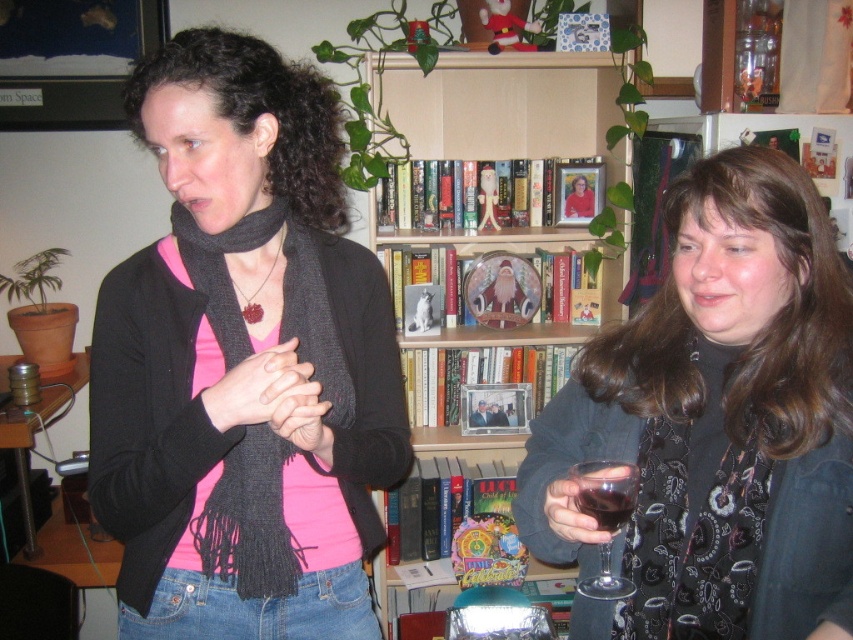
Question: From the image, what is the correct spatial relationship of dark glass at right in relation to smooth wooden frame at center?

Choices:
 (A) above
 (B) below

Answer: (A)

Question: Which object is positioned closest to the transparent glass wine glass at lower right?

Choices:
 (A) black knitted scarf at left
 (B) smooth wooden frame at center
 (C) matte black scarf at center

Answer: (A)

Question: In this image, where is matte black jacket at right located relative to transparent glass wine glass at lower right?

Choices:
 (A) right
 (B) left

Answer: (A)

Question: Which object is positioned closest to the matte black scarf at center?

Choices:
 (A) dark glass at right
 (B) smooth wooden frame at center

Answer: (A)

Question: Based on their relative distances, which object is nearer to the wooden bookshelf at center?

Choices:
 (A) smooth wooden frame at center
 (B) dark glass at right

Answer: (A)

Question: Can you confirm if wooden bookshelf at center is thinner than smooth wooden frame at center?

Choices:
 (A) no
 (B) yes

Answer: (A)